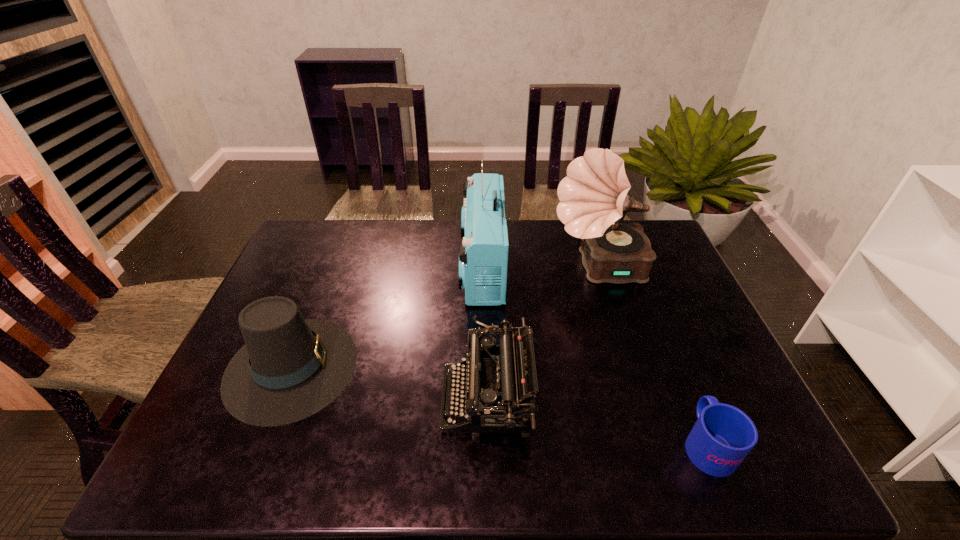
I want to click on free space located 0.110m on the front-facing side of the radio receiver, so click(426, 267).

Find the location of `free space located on the front-facing side of the leftmost object`. free space located on the front-facing side of the leftmost object is located at coordinates (493, 367).

Where is `vacant region located on the keyboard of the typewriter`? The width and height of the screenshot is (960, 540). vacant region located on the keyboard of the typewriter is located at coordinates (421, 400).

This screenshot has width=960, height=540. I want to click on vacant area located 0.350m on the keyboard of the typewriter, so click(x=295, y=400).

Identify the location of vacant space located on the keyboard of the typewriter. The image size is (960, 540). (400, 400).

Image resolution: width=960 pixels, height=540 pixels. Find the location of `vacant area located on the side with the handle of the mug`. vacant area located on the side with the handle of the mug is located at coordinates (666, 345).

Where is `vacant space located on the side with the handle of the mug`? vacant space located on the side with the handle of the mug is located at coordinates (646, 295).

The width and height of the screenshot is (960, 540). In order to click on vacant space located on the side with the handle of the mug in this screenshot , I will do `click(665, 341)`.

Locate an element on the screen. record player that is at the far edge is located at coordinates (593, 196).

Identify the location of radio receiver positioned at the far edge. This screenshot has width=960, height=540. (483, 256).